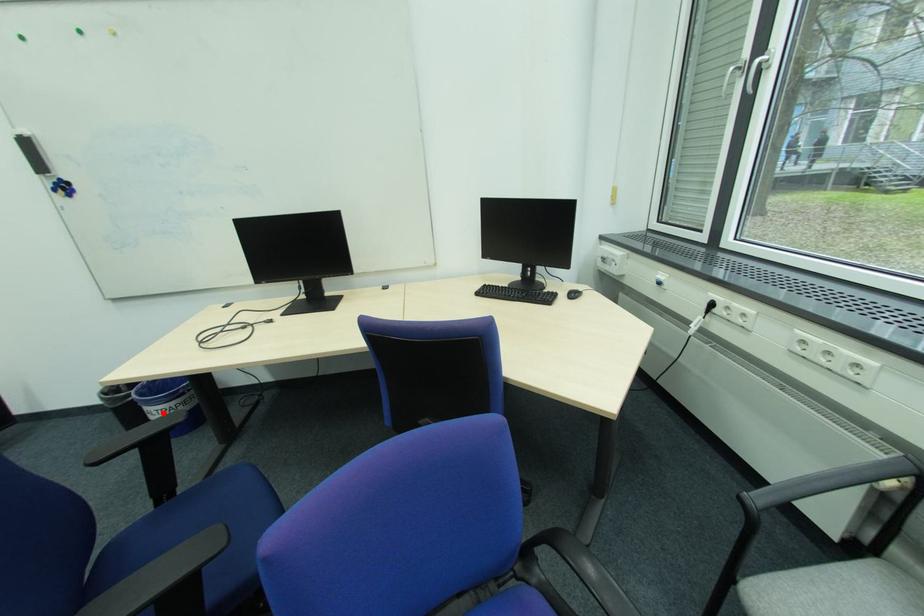
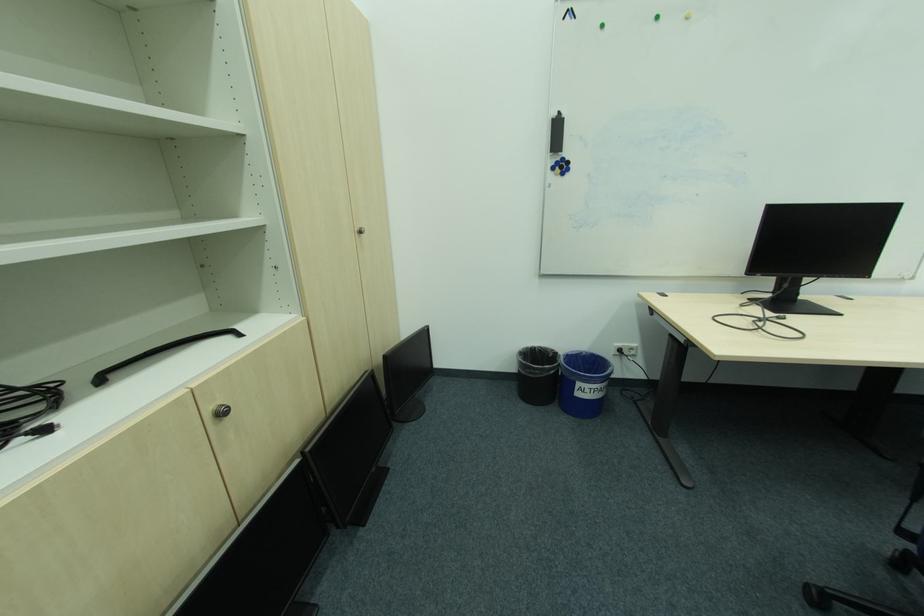
Question: I am providing you with two images of the same scene from different viewpoints. Image1 has a red point marked. In image2, the corresponding 3D location appears at what relative position? Reply with the corresponding letter.

Choices:
 (A) Closer
 (B) Farther

Answer: (B)